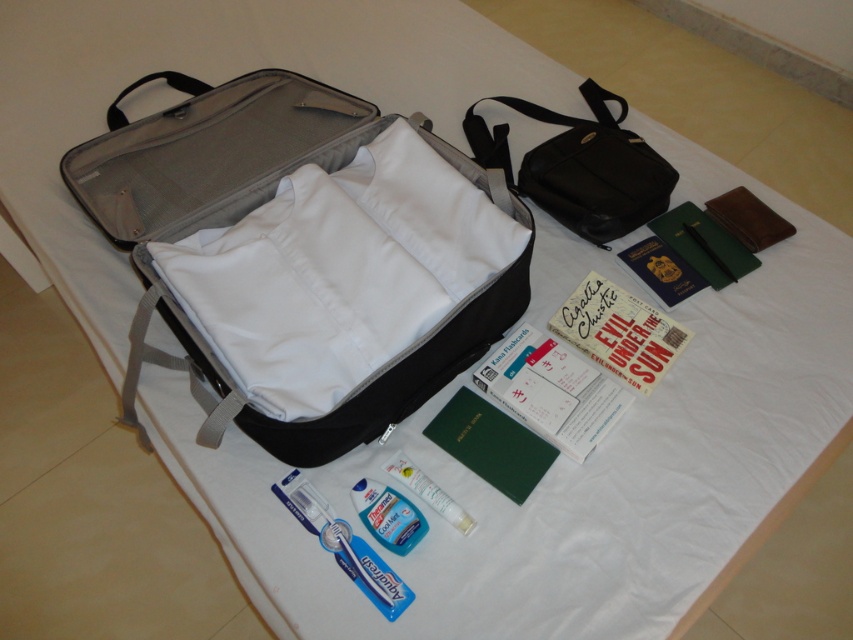
Which is more to the right, blue glossy toothpaste at lower center or blue gel-like container at lower center?

From the viewer's perspective, blue gel-like container at lower center appears more on the right side.

Which is more to the left, blue glossy toothpaste at lower center or blue gel-like container at lower center?

Positioned to the left is blue glossy toothpaste at lower center.

Describe the element at coordinates (366, 570) in the screenshot. This screenshot has width=853, height=640. I see `blue glossy toothpaste at lower center` at that location.

At what (x,y) coordinates should I click in order to perform the action: click on blue glossy toothpaste at lower center. Please return your answer as a coordinate pair (x, y). The height and width of the screenshot is (640, 853). Looking at the image, I should click on (366, 570).

Can you confirm if blue gel-like container at lower center is positioned to the left of translucent plastic tube at center?

Indeed, blue gel-like container at lower center is positioned on the left side of translucent plastic tube at center.

Based on the photo, who is shorter, blue gel-like container at lower center or translucent plastic tube at center?

blue gel-like container at lower center

Where is `blue gel-like container at lower center`? blue gel-like container at lower center is located at coordinates (387, 515).

Who is positioned more to the right, blue glossy toothpaste at lower center or translucent plastic tube at center?

translucent plastic tube at center is more to the right.

At what (x,y) coordinates should I click in order to perform the action: click on blue glossy toothpaste at lower center. Please return your answer as a coordinate pair (x, y). This screenshot has height=640, width=853. Looking at the image, I should click on (366, 570).

You are a GUI agent. You are given a task and a screenshot of the screen. Output one action in this format:
    pyautogui.click(x=<x>, y=<y>)
    Task: Click on the blue glossy toothpaste at lower center
    
    Given the screenshot: What is the action you would take?
    pyautogui.click(x=366, y=570)